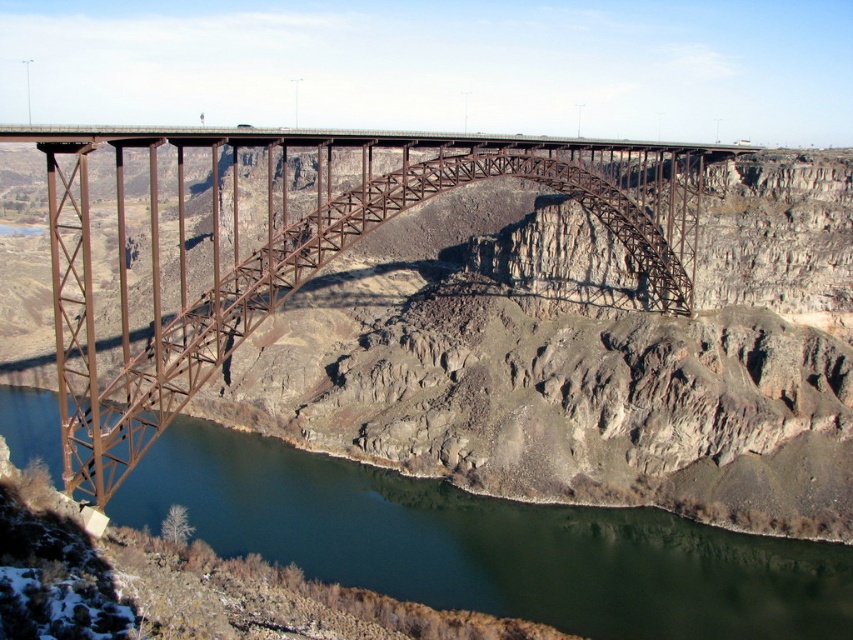
Question: Observing the image, what is the correct spatial positioning of rusty metal bridge at center in reference to greenish-blue water at center?

Choices:
 (A) above
 (B) below

Answer: (A)

Question: Is rusty metal bridge at center smaller than greenish-blue water at center?

Choices:
 (A) yes
 (B) no

Answer: (B)

Question: Observing the image, what is the correct spatial positioning of rusty metal bridge at center in reference to greenish-blue water at center?

Choices:
 (A) below
 (B) above

Answer: (B)

Question: Which point is farther to the camera?

Choices:
 (A) (299, 132)
 (B) (535, 550)

Answer: (B)